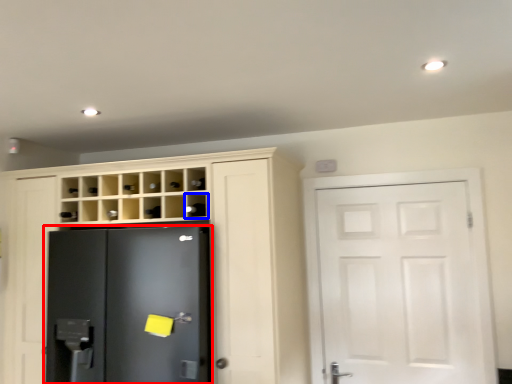
Question: Among these objects, which one is nearest to the camera, refrigerator (highlighted by a red box) or shelf (highlighted by a blue box)?

Choices:
 (A) refrigerator
 (B) shelf

Answer: (A)